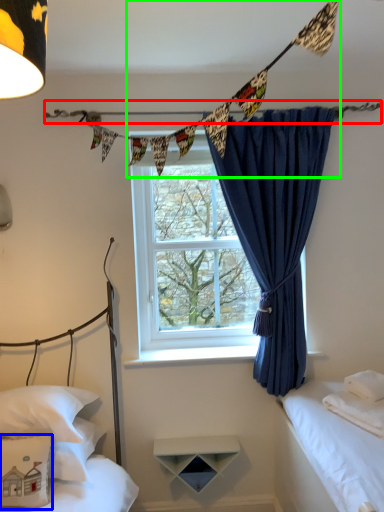
Question: Based on their relative distances, which object is farther from clothesline (highlighted by a red box)? Choose from pillow (highlighted by a blue box) and clothesline (highlighted by a green box).

Choices:
 (A) pillow
 (B) clothesline

Answer: (A)